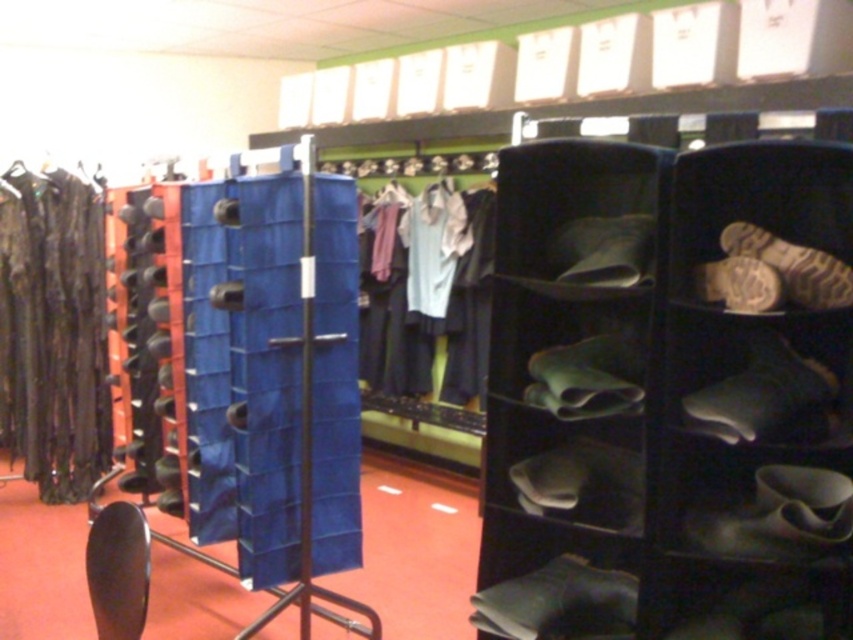
You are a customer in the store and want to examine the black fabric shoe rack at right. Considering the distance between you and the rack, can you clearly see the details of the shoes displayed on it without moving closer?

The black fabric shoe rack at right is 1.50 meters from the camera, so yes, you can clearly see the details of the shoes displayed on it without needing to move closer.

You are standing in the retail store and want to take a photo of both point (74, 349) and point (468, 324). Which point should you focus on first to ensure both are in clear view?

You should focus on point (74, 349) first because it is closer to the camera than point (468, 324). By focusing on the closer point, the depth of field may allow the farther point to remain in acceptable focus.